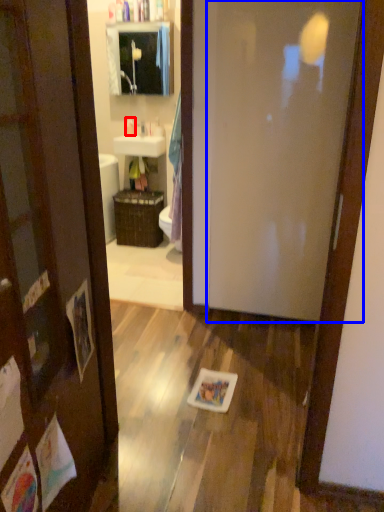
Question: Which object is further to the camera taking this photo, toiletry (highlighted by a red box) or door (highlighted by a blue box)?

Choices:
 (A) toiletry
 (B) door

Answer: (A)